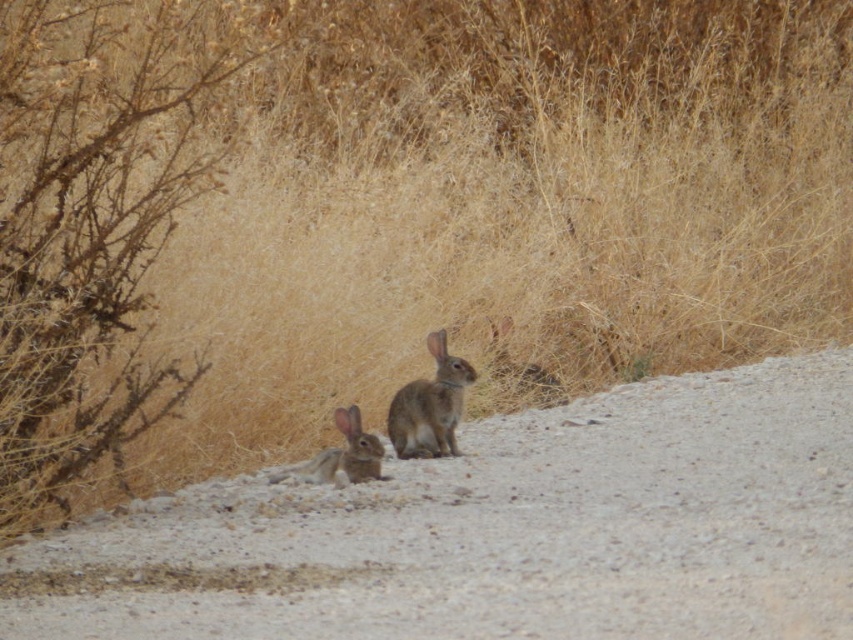
Who is more forward, (624, 504) or (192, 77)?

Point (624, 504) is in front.

Is point (206, 556) positioned before point (157, 140)?

Yes.

Identify the location of gray gravel road at center. The image size is (853, 640). (500, 531).

Which is more to the right, gray gravel road at center or furry brown rabbit at center?

gray gravel road at center

The image size is (853, 640). I want to click on gray gravel road at center, so click(x=500, y=531).

Between brown dry bush at left and fuzzy brown rabbit at center, which one appears on the right side from the viewer's perspective?

fuzzy brown rabbit at center

Which is behind, point (109, 253) or point (436, 419)?

The point (436, 419) is more distant.

Who is more distant from viewer, (54, 419) or (440, 410)?

Positioned behind is point (440, 410).

I want to click on brown dry bush at left, so click(x=97, y=216).